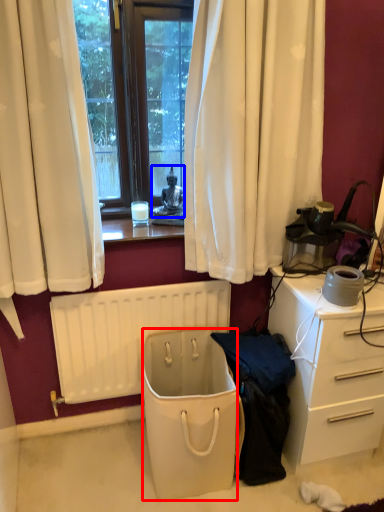
Question: Which point is further to the camera, trash bin/can (highlighted by a red box) or person (highlighted by a blue box)?

Choices:
 (A) trash bin/can
 (B) person

Answer: (B)